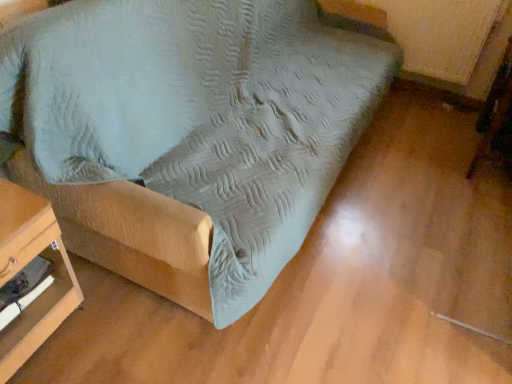
I want to click on vacant area that lies between wooden swivel chair at lower right and suede-like fabric couch at center, placed as the 1th furniture when sorted from right to left, so coord(400,193).